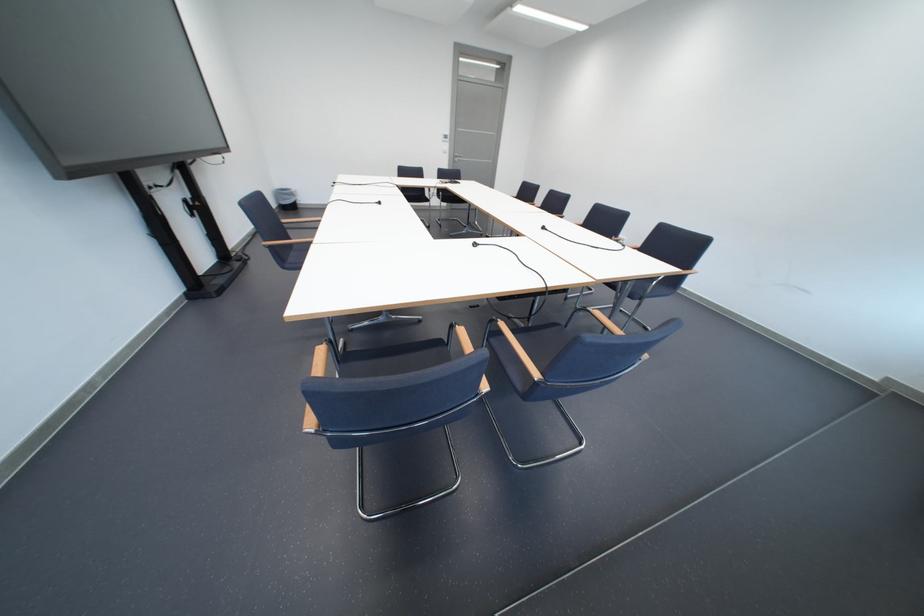
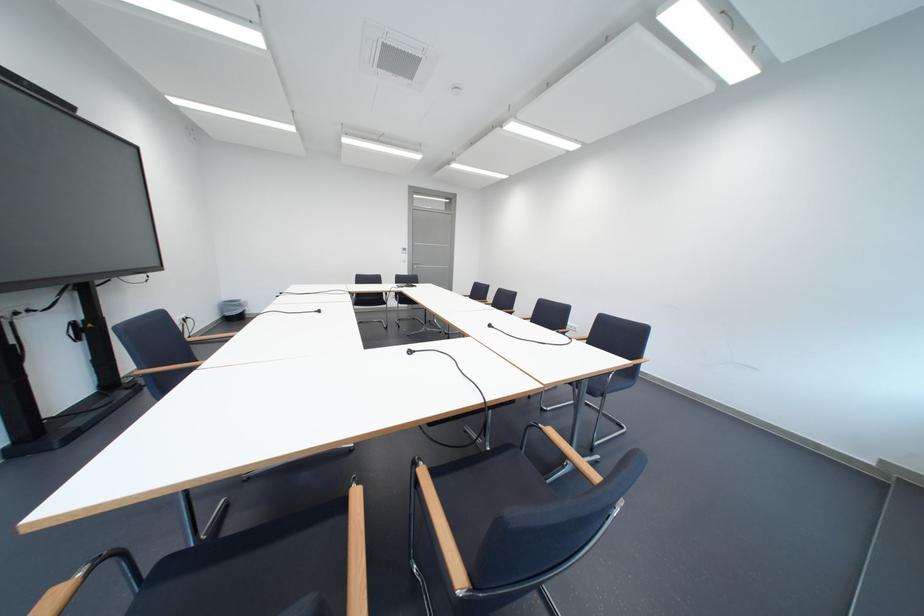
Locate, in the second image, the point that corresponds to the point at 601,313 in the first image.

(553, 431)